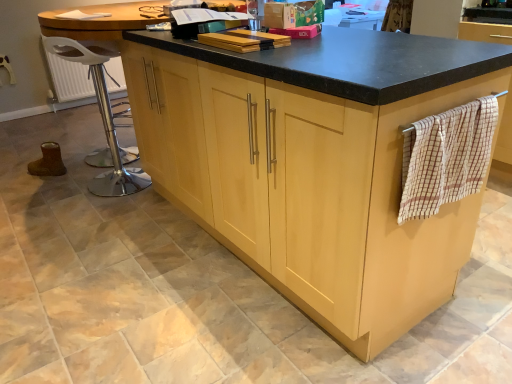
Question: Could you tell me if light wood cabinetry at center is turned towards metallic silver bar stool at left?

Choices:
 (A) no
 (B) yes

Answer: (A)

Question: Would you say light wood cabinetry at center is outside metallic silver bar stool at left?

Choices:
 (A) yes
 (B) no

Answer: (A)

Question: Does light wood cabinetry at center appear on the right side of metallic silver bar stool at left?

Choices:
 (A) no
 (B) yes

Answer: (B)

Question: Is light wood cabinetry at center positioned with its back to metallic silver bar stool at left?

Choices:
 (A) no
 (B) yes

Answer: (A)

Question: Is the depth of light wood cabinetry at center less than that of metallic silver bar stool at left?

Choices:
 (A) no
 (B) yes

Answer: (B)

Question: Is beige checkered towel at right wider or thinner than light wood cabinetry at center?

Choices:
 (A) wide
 (B) thin

Answer: (B)

Question: Is beige checkered towel at right in front of or behind light wood cabinetry at center in the image?

Choices:
 (A) behind
 (B) front

Answer: (A)

Question: From the image's perspective, relative to light wood cabinetry at center, is beige checkered towel at right above or below?

Choices:
 (A) above
 (B) below

Answer: (B)

Question: From a real-world perspective, relative to light wood cabinetry at center, is beige checkered towel at right vertically above or below?

Choices:
 (A) below
 (B) above

Answer: (B)

Question: In terms of size, does metallic silver bar stool at left appear bigger or smaller than light wood cabinetry at center?

Choices:
 (A) small
 (B) big

Answer: (A)

Question: From a real-world perspective, relative to light wood cabinetry at center, is metallic silver bar stool at left vertically above or below?

Choices:
 (A) above
 (B) below

Answer: (B)

Question: In the image, is metallic silver bar stool at left on the left side or the right side of light wood cabinetry at center?

Choices:
 (A) left
 (B) right

Answer: (A)

Question: In terms of width, does metallic silver bar stool at left look wider or thinner when compared to light wood cabinetry at center?

Choices:
 (A) wide
 (B) thin

Answer: (B)

Question: Considering the positions of beige checkered towel at right and metallic silver bar stool at left in the image, is beige checkered towel at right bigger or smaller than metallic silver bar stool at left?

Choices:
 (A) big
 (B) small

Answer: (B)

Question: Considering the relative positions of beige checkered towel at right and metallic silver bar stool at left in the image provided, is beige checkered towel at right to the left or to the right of metallic silver bar stool at left?

Choices:
 (A) right
 (B) left

Answer: (A)